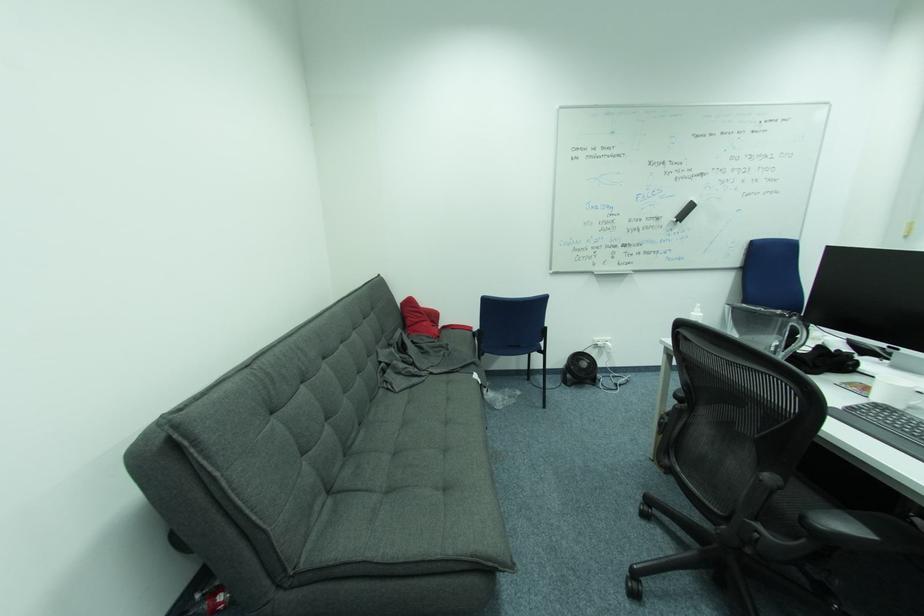
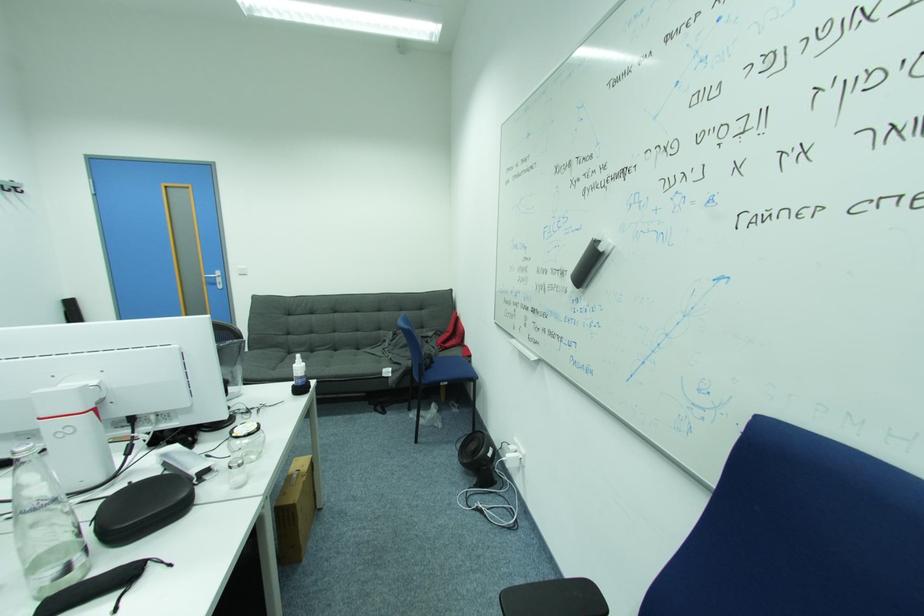
Find the pixel in the second image that matches [667,221] in the first image.

(572, 277)